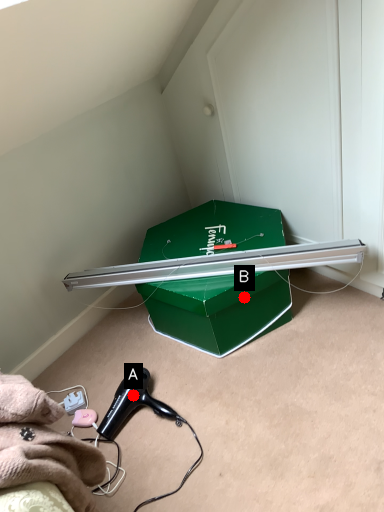
Question: Two points are circled on the image, labeled by A and B beside each circle. Which point appears closest to the camera in this image?

Choices:
 (A) A is closer
 (B) B is closer

Answer: (B)